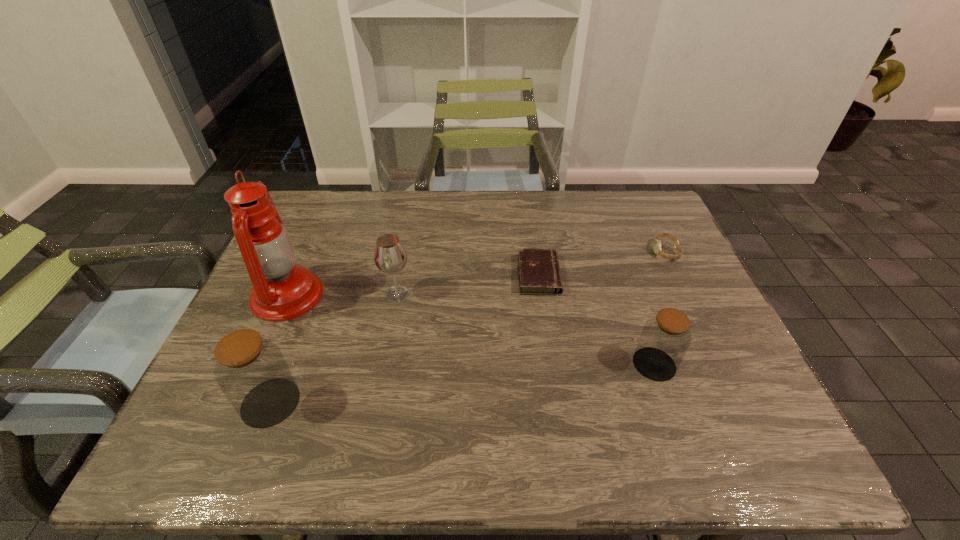
Locate an element on the screen. The width and height of the screenshot is (960, 540). watch that is at the right edge is located at coordinates click(657, 243).

The width and height of the screenshot is (960, 540). Find the location of `object that is at the near left corner`. object that is at the near left corner is located at coordinates (251, 371).

Image resolution: width=960 pixels, height=540 pixels. Find the location of `object that is at the near right corner`. object that is at the near right corner is located at coordinates (665, 338).

Image resolution: width=960 pixels, height=540 pixels. Find the location of `free space at the far edge`. free space at the far edge is located at coordinates (421, 227).

In the image, there is a desktop. At what (x,y) coordinates should I click in order to perform the action: click on free space at the near edge. Please return your answer as a coordinate pair (x, y). Looking at the image, I should click on (607, 391).

In the image, there is a desktop. At what (x,y) coordinates should I click in order to perform the action: click on vacant area at the right edge. Please return your answer as a coordinate pair (x, y). The height and width of the screenshot is (540, 960). Looking at the image, I should click on (712, 351).

Find the location of a particular element. Image resolution: width=960 pixels, height=540 pixels. vacant space at the far left corner of the desktop is located at coordinates (333, 204).

You are a GUI agent. You are given a task and a screenshot of the screen. Output one action in this format:
    pyautogui.click(x=<x>, y=<y>)
    Task: Click on the vacant space at the near left corner of the desktop
    
    Given the screenshot: What is the action you would take?
    pyautogui.click(x=218, y=392)

In the image, there is a desktop. Identify the location of free space at the far right corner. (636, 220).

The width and height of the screenshot is (960, 540). In order to click on free point between the wineglass and the shorter jar in this screenshot , I will do `click(526, 329)`.